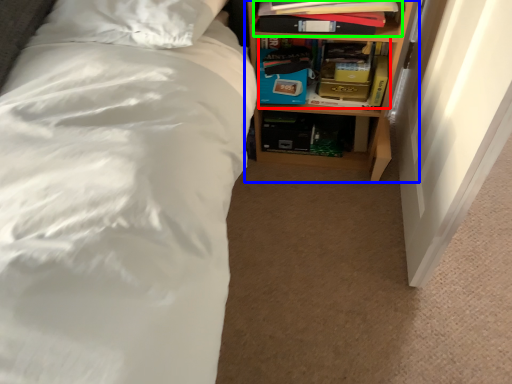
Question: Considering the real-world distances, which object is farthest from book (highlighted by a red box)? shelf (highlighted by a blue box) or book (highlighted by a green box)?

Choices:
 (A) shelf
 (B) book

Answer: (B)